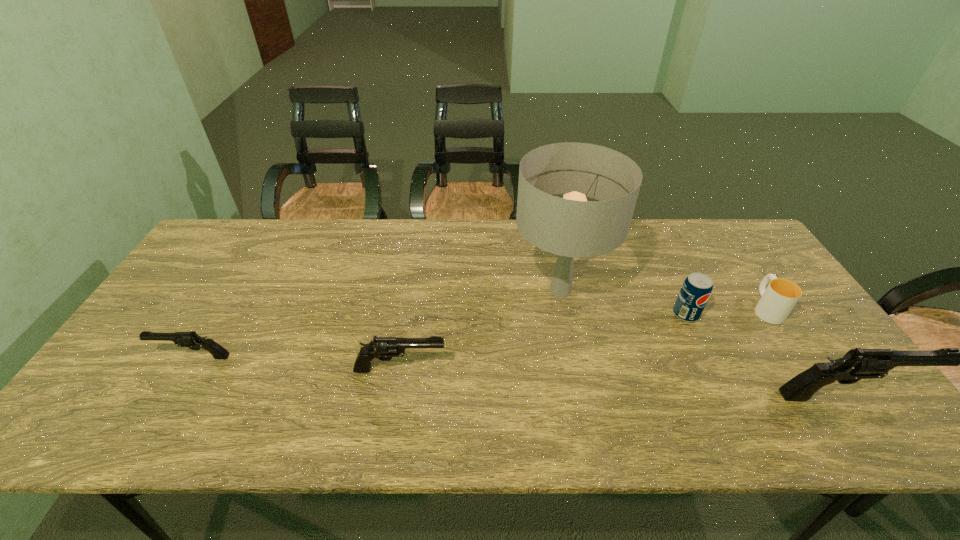
You are a GUI agent. You are given a task and a screenshot of the screen. Output one action in this format:
    pyautogui.click(x=<x>, y=<y>)
    Task: Click on the vacant area that lies between the lampshade and the second farthest gun
    The height and width of the screenshot is (540, 960).
    Given the screenshot: What is the action you would take?
    pyautogui.click(x=480, y=330)

Find the location of a particular element. free space between the nearest gun and the fifth farthest object is located at coordinates (624, 382).

You are a GUI agent. You are given a task and a screenshot of the screen. Output one action in this format:
    pyautogui.click(x=<x>, y=<y>)
    Task: Click on the free point between the third object from right to left and the farthest gun
    
    Given the screenshot: What is the action you would take?
    440,336

Locate an element on the screen. The image size is (960, 540). free area in between the cup and the pop is located at coordinates (726, 312).

At what (x,y) coordinates should I click in order to perform the action: click on vacant area that lies between the rightmost gun and the third object from right to left. Please return your answer as a coordinate pair (x, y). Looking at the image, I should click on (767, 355).

In order to click on vacant region between the farthest gun and the fifth shortest object in this screenshot , I will do `click(520, 376)`.

The height and width of the screenshot is (540, 960). Find the location of `vacant area between the farthest gun and the tallest gun`. vacant area between the farthest gun and the tallest gun is located at coordinates (520, 376).

This screenshot has width=960, height=540. Identify the location of free space that is in between the rightmost gun and the third object from left to right. (704, 343).

This screenshot has width=960, height=540. I want to click on vacant area between the cup and the second tallest gun, so click(x=584, y=339).

Where is `free space between the second gun from left to right and the fourth object from left to right`? free space between the second gun from left to right and the fourth object from left to right is located at coordinates (543, 342).